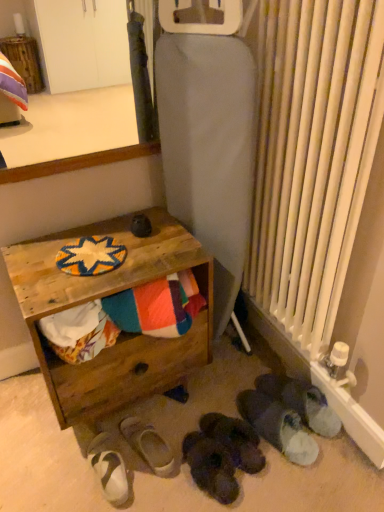
I want to click on vacant point to the left of white fuzzy slippers at lower right, which is the second footwear from right to left, so click(x=196, y=408).